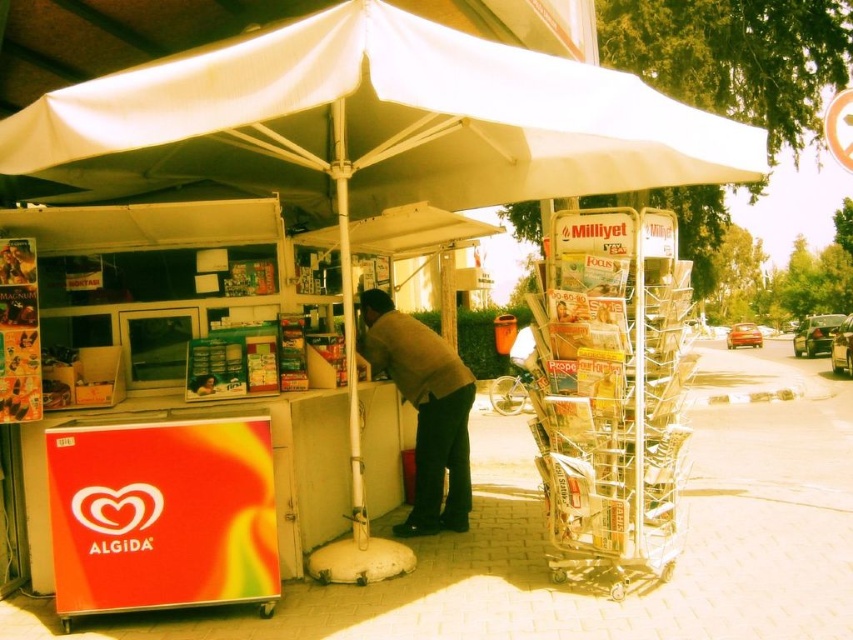
Question: Among these objects, which one is farthest from the camera?

Choices:
 (A) brown woolen sweater at center
 (B) white fabric canopy at center

Answer: (A)

Question: Does white fabric canopy at center have a smaller size compared to metallic silver magazine rack at right?

Choices:
 (A) yes
 (B) no

Answer: (B)

Question: Which point is farther from the camera taking this photo?

Choices:
 (A) (573, 228)
 (B) (387, 349)
 (C) (53, 108)

Answer: (B)

Question: Is white fabric canopy at center wider than brown woolen sweater at center?

Choices:
 (A) no
 (B) yes

Answer: (B)

Question: Which object is positioned farthest from the metallic silver magazine rack at right?

Choices:
 (A) brown woolen sweater at center
 (B) white fabric canopy at center

Answer: (B)

Question: Considering the relative positions of metallic silver magazine rack at right and brown woolen sweater at center in the image provided, where is metallic silver magazine rack at right located with respect to brown woolen sweater at center?

Choices:
 (A) left
 (B) right

Answer: (B)